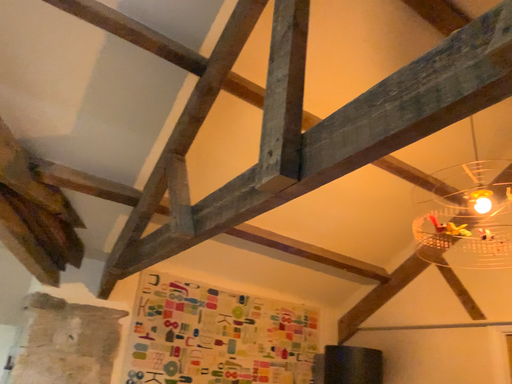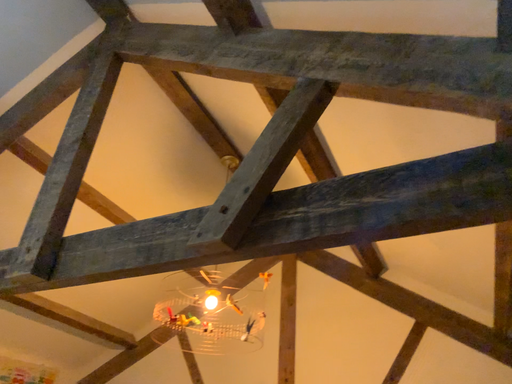
Question: How did the camera likely rotate when shooting the video?

Choices:
 (A) rotated left
 (B) rotated right

Answer: (B)